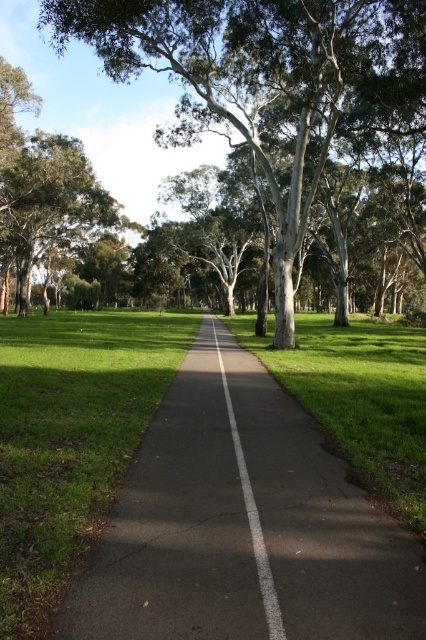
Consider the image. You are standing on the paved pathway in the park and want to determine which tree is taller between the green leafy tree at center and the green leafy tree at upper left. Based on the scene, which one is taller?

The green leafy tree at center is taller than the green leafy tree at upper left.

You are standing at point (14, 182) in the park and want to walk to point (222, 323). Which direction should you move relative to the pathway and trees?

A: Point (222, 323) is behind point (14, 182), so you should move in the direction away from the pathway and towards the trees to reach your destination.

You are standing at the end of the pathway in the park and see the green leafy tree at center and the green leafy tree at upper left. Which tree is positioned more to the left side of the scene?

The green leafy tree at center is positioned more to the left side of the scene compared to the green leafy tree at upper left.